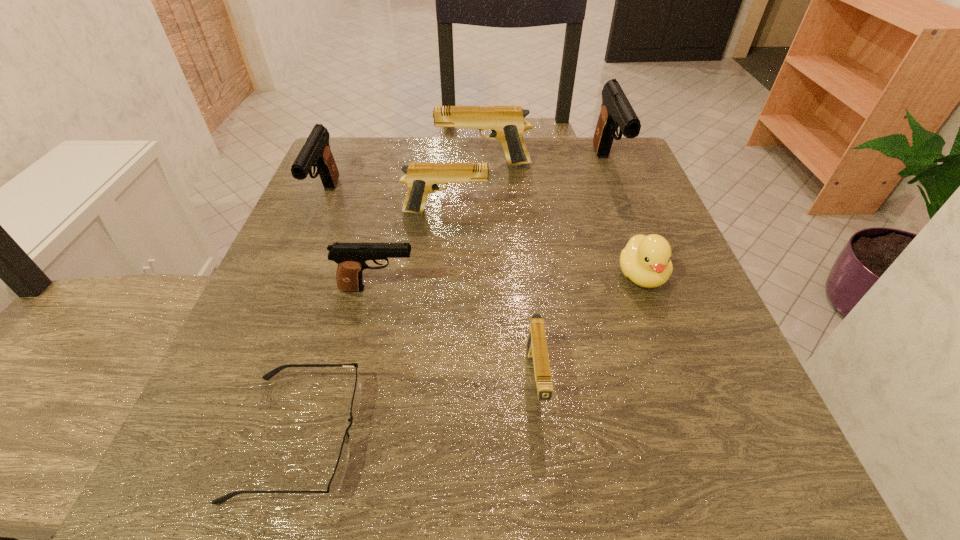
This screenshot has width=960, height=540. Find the location of `empty space between the nearest tan pistol and the farthest tan pistol`. empty space between the nearest tan pistol and the farthest tan pistol is located at coordinates (510, 273).

The image size is (960, 540). Find the location of `vacant space that's between the nearest black pistol and the second farthest tan pistol`. vacant space that's between the nearest black pistol and the second farthest tan pistol is located at coordinates (412, 251).

Image resolution: width=960 pixels, height=540 pixels. I want to click on free spot between the nearest black pistol and the shortest object, so click(339, 362).

You are a GUI agent. You are given a task and a screenshot of the screen. Output one action in this format:
    pyautogui.click(x=<x>, y=<y>)
    Task: Click on the free spot between the nearest tan pistol and the second biggest black pistol
    Image resolution: width=960 pixels, height=540 pixels.
    Given the screenshot: What is the action you would take?
    pyautogui.click(x=430, y=291)

Image resolution: width=960 pixels, height=540 pixels. Identify the location of free space between the biggest black pistol and the black spectacles. (453, 301).

At what (x,y) coordinates should I click in order to perform the action: click on free point between the duckling and the second biggest black pistol. Please return your answer as a coordinate pair (x, y). Image resolution: width=960 pixels, height=540 pixels. Looking at the image, I should click on (484, 237).

I want to click on empty location between the second biggest tan pistol and the smallest black pistol, so click(412, 251).

Identify the location of object that can be found as the seventh closest to the nearest black pistol. (616, 112).

This screenshot has height=540, width=960. In order to click on the fourth closest object to the duckling in this screenshot , I will do `click(507, 123)`.

Find the location of a particular element. the closest pistol to the biggest black pistol is located at coordinates (507, 123).